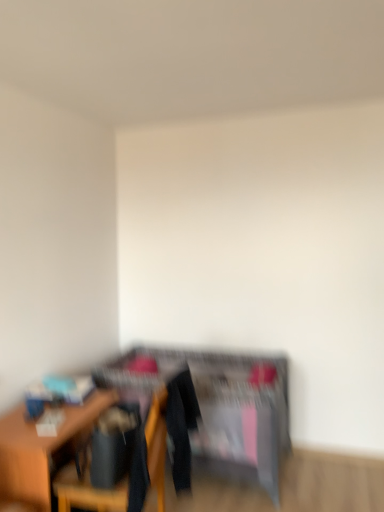
Question: Choose the correct answer: Is wooden dresser at center inside wooden chair at lower left or outside it?

Choices:
 (A) inside
 (B) outside

Answer: (B)

Question: Is wooden dresser at center in front of or behind wooden chair at lower left in the image?

Choices:
 (A) front
 (B) behind

Answer: (B)

Question: Estimate the real-world distances between objects in this image. Which object is closer to the wooden table at left?

Choices:
 (A) wooden chair at lower left
 (B) wooden dresser at center

Answer: (A)

Question: Which is farther from the wooden table at left?

Choices:
 (A) wooden chair at lower left
 (B) wooden dresser at center

Answer: (B)